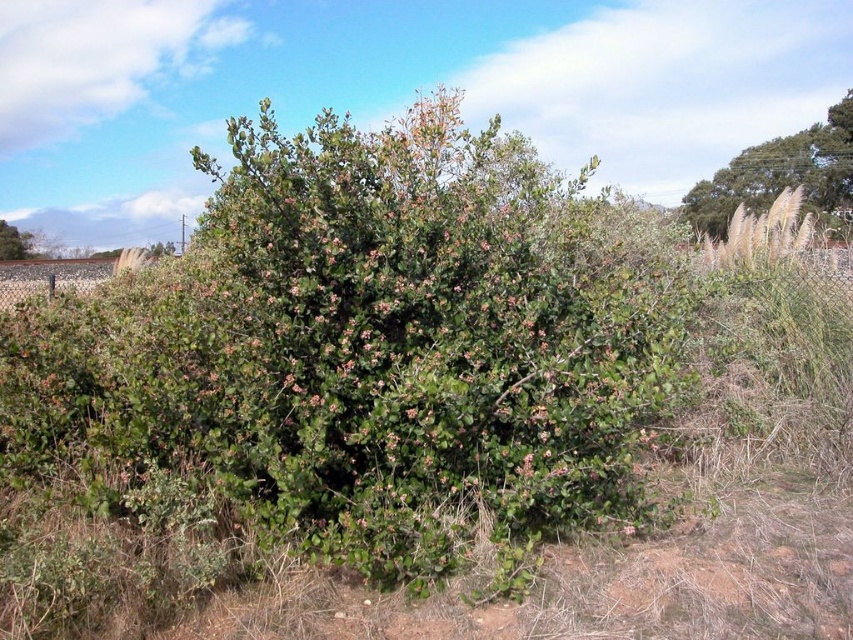
Question: Does green leafy bush at upper right appear on the left side of green leafy bush at left?

Choices:
 (A) no
 (B) yes

Answer: (A)

Question: Can you confirm if green leafy bush at upper right is thinner than green leafy bush at left?

Choices:
 (A) yes
 (B) no

Answer: (A)

Question: Which point is closer to the camera?

Choices:
 (A) green leafy bush at left
 (B) green leafy bush at upper right

Answer: (A)

Question: Can you confirm if green leafy bush at upper right is positioned to the left of green leafy bush at left?

Choices:
 (A) no
 (B) yes

Answer: (A)

Question: Among these objects, which one is nearest to the camera?

Choices:
 (A) green leafy bush at left
 (B) green leafy bush at upper right

Answer: (A)

Question: Which point is closer to the camera taking this photo?

Choices:
 (A) (21, 253)
 (B) (732, 198)

Answer: (A)